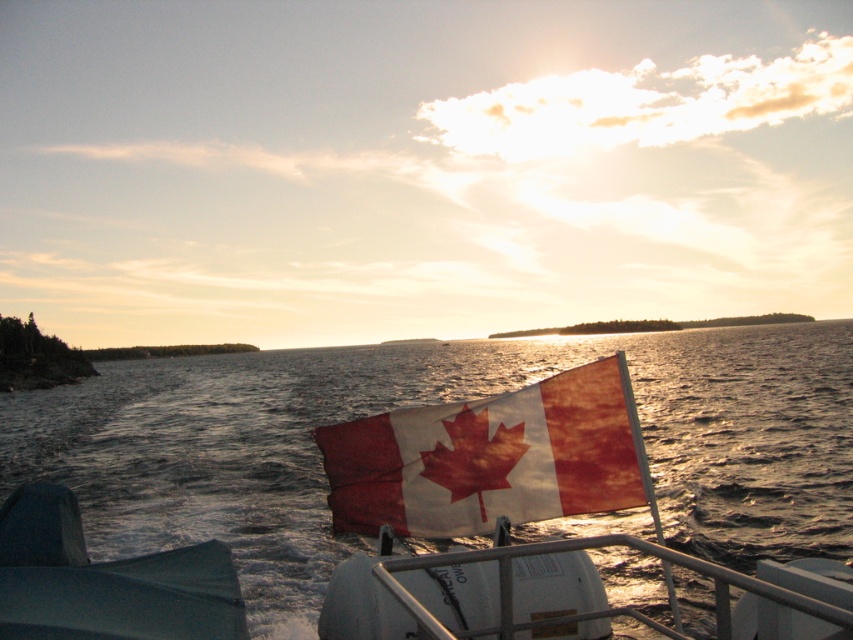
Question: Is translucent water at center smaller than worn fabric flag at center?

Choices:
 (A) yes
 (B) no

Answer: (B)

Question: Which of the following is the closest to the observer?

Choices:
 (A) translucent water at center
 (B) worn fabric flag at center

Answer: (B)

Question: Which point is closer to the camera?

Choices:
 (A) (335, 518)
 (B) (292, 595)

Answer: (A)

Question: Does translucent water at center come behind worn fabric flag at center?

Choices:
 (A) yes
 (B) no

Answer: (A)

Question: Can you confirm if translucent water at center is thinner than worn fabric flag at center?

Choices:
 (A) no
 (B) yes

Answer: (A)